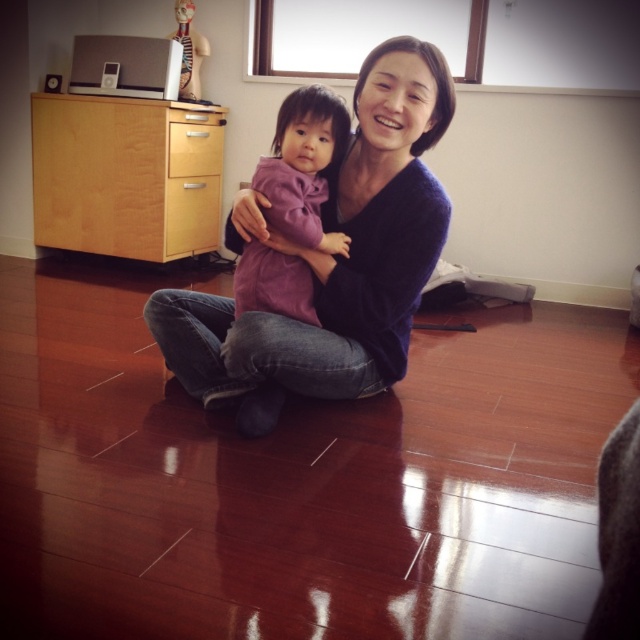
Question: Which object appears farthest from the camera in this image?

Choices:
 (A) light wood drawer at left
 (B) light wood dresser at left
 (C) purple soft fabric baby at center

Answer: (A)

Question: Does dark blue sweater at center appear on the right side of light wood dresser at left?

Choices:
 (A) yes
 (B) no

Answer: (A)

Question: Does light wood dresser at left appear on the right side of purple soft fabric baby at center?

Choices:
 (A) yes
 (B) no

Answer: (B)

Question: Which object is closer to the camera taking this photo?

Choices:
 (A) dark blue sweater at center
 (B) light wood drawer at left

Answer: (A)

Question: Does purple soft fabric baby at center appear on the left side of light wood drawer at left?

Choices:
 (A) yes
 (B) no

Answer: (B)

Question: Considering the real-world distances, which object is farthest from the purple soft fabric baby at center?

Choices:
 (A) dark blue sweater at center
 (B) light wood drawer at left
 (C) light wood dresser at left

Answer: (C)